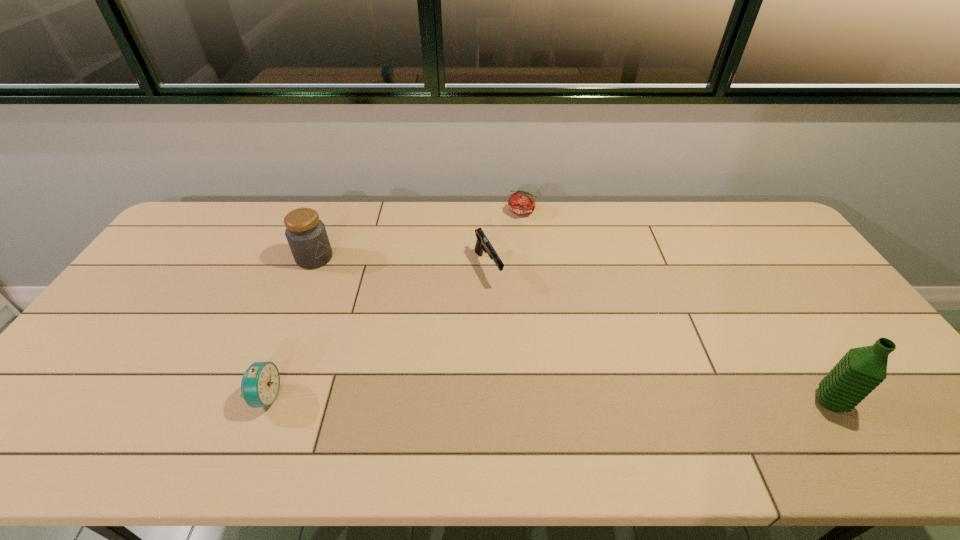
At what (x,y) coordinates should I click in order to perform the action: click on water bottle that is at the near edge. Please return your answer as a coordinate pair (x, y). Image resolution: width=960 pixels, height=540 pixels. Looking at the image, I should click on (861, 370).

The image size is (960, 540). Find the location of `vacant space at the far edge of the desktop`. vacant space at the far edge of the desktop is located at coordinates (429, 214).

In the image, there is a desktop. Find the location of `vacant region at the near edge`. vacant region at the near edge is located at coordinates (257, 409).

At what (x,y) coordinates should I click in order to perform the action: click on free space at the right edge of the desktop. Please return your answer as a coordinate pair (x, y). Image resolution: width=960 pixels, height=540 pixels. Looking at the image, I should click on (762, 262).

Image resolution: width=960 pixels, height=540 pixels. In order to click on vacant space at the near left corner of the desktop in this screenshot , I will do `click(85, 393)`.

Locate an element on the screen. free space that is in between the shortest object and the second tallest object is located at coordinates (418, 235).

You are a GUI agent. You are given a task and a screenshot of the screen. Output one action in this format:
    pyautogui.click(x=<x>, y=<y>)
    Task: Click on the unoccupied area between the third object from right to left and the shortest object
    
    Given the screenshot: What is the action you would take?
    pyautogui.click(x=505, y=240)

This screenshot has width=960, height=540. What are the coordinates of `vacant area that lies between the alarm clock and the third object from right to left` in the screenshot? It's located at (377, 332).

Find the location of a particular element. This screenshot has width=960, height=540. empty space that is in between the fourth object from left to right and the alarm clock is located at coordinates (394, 304).

Identify the location of vacant space that is in between the tallest object and the alarm clock. The image size is (960, 540). point(547,399).